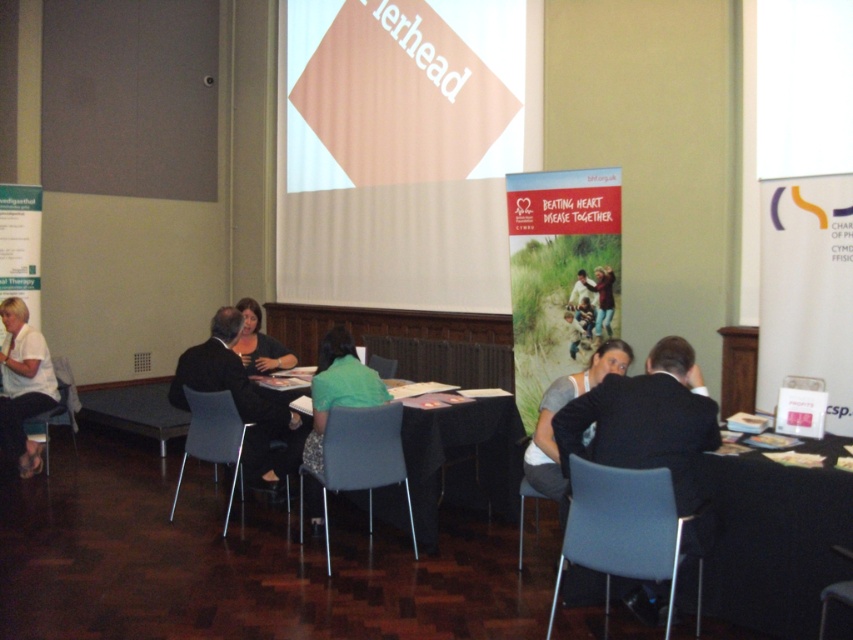
Question: Can you confirm if black fabric table at center is smaller than matte blue chair at lower right?

Choices:
 (A) no
 (B) yes

Answer: (A)

Question: Which point is closer to the camera?

Choices:
 (A) (242, 332)
 (B) (608, 282)

Answer: (B)

Question: Is matte gray chair at center positioned in front of white cotton shirt at center?

Choices:
 (A) no
 (B) yes

Answer: (A)

Question: Which point is closer to the camera?

Choices:
 (A) matte blue chair at lower right
 (B) black fabric table at center
 (C) black fabric table at lower right
 (D) white matte projection screen at upper center

Answer: (C)

Question: Is matte black shirt at center closer to camera compared to matte blue chair at lower right?

Choices:
 (A) no
 (B) yes

Answer: (A)

Question: Which of these objects is positioned closest to the matte gray chair at lower right?

Choices:
 (A) matte black shirt at center
 (B) white cotton shirt at center
 (C) green fabric shirt at center
 (D) black fabric table at center

Answer: (B)